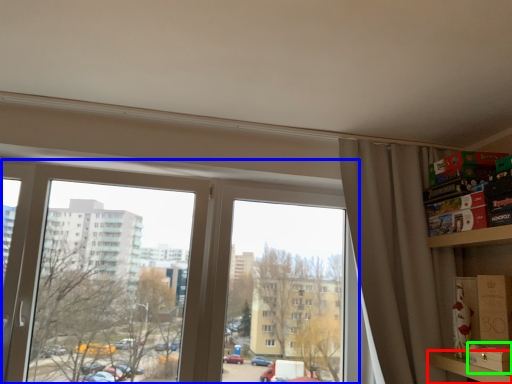
Question: Considering the real-world distances, which object is closest to shelf (highlighted by a red box)? window (highlighted by a blue box) or cardboard box (highlighted by a green box).

Choices:
 (A) window
 (B) cardboard box

Answer: (B)